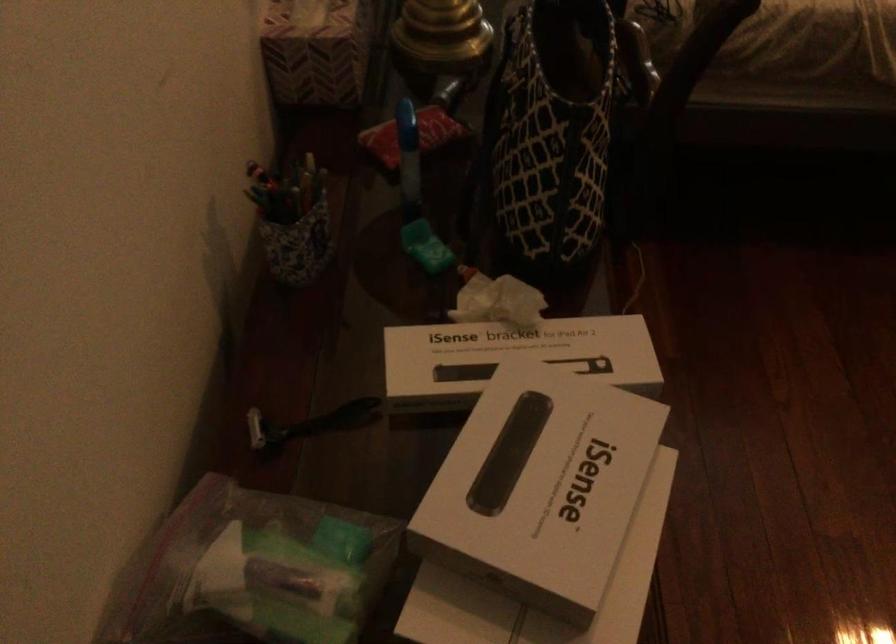
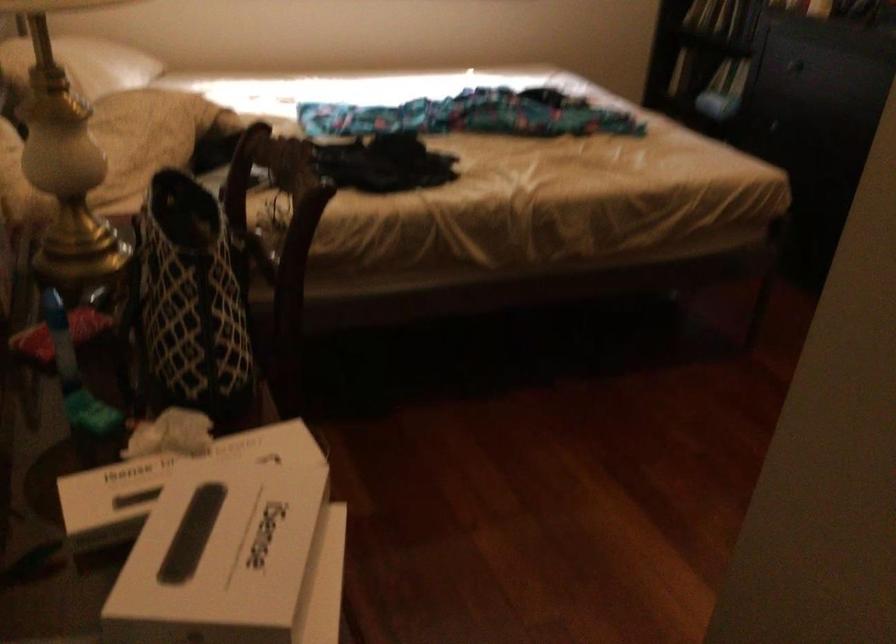
Find the pixel in the second image that matches (x=540, y=498) in the first image.

(234, 560)